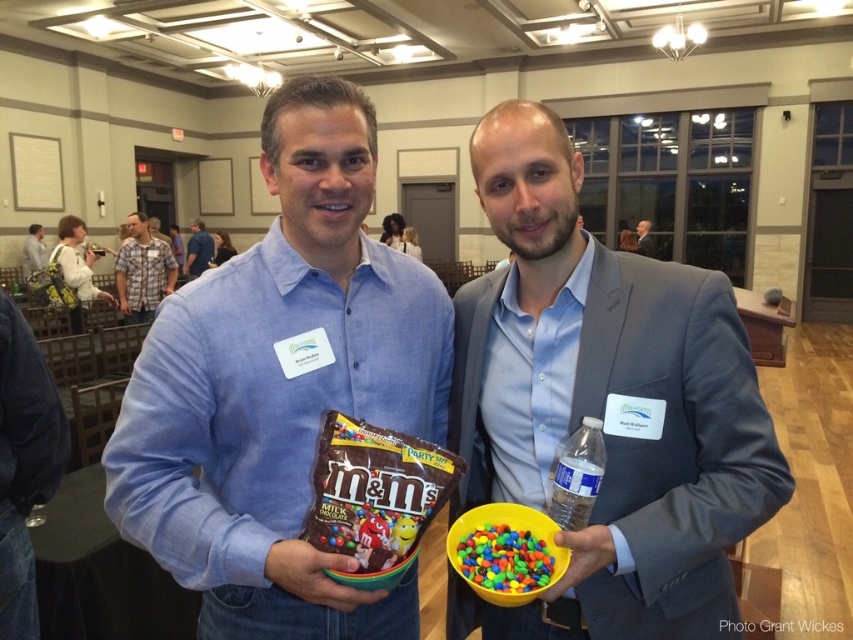
Which is more to the right, matte blue shirt at center or light brown leather jacket at upper left?

From the viewer's perspective, matte blue shirt at center appears more on the right side.

Does point (335, 621) lie behind point (56, 253)?

No, (335, 621) is closer to viewer.

Locate an element on the screen. matte blue shirt at center is located at coordinates (281, 387).

The height and width of the screenshot is (640, 853). Find the location of `matte blue shirt at center`. matte blue shirt at center is located at coordinates (281, 387).

Is matte blue shirt at center to the left of dark gray suit at upper right from the viewer's perspective?

Yes, matte blue shirt at center is to the left of dark gray suit at upper right.

Is point (274, 388) farther from camera compared to point (653, 253)?

No, (274, 388) is closer to viewer.

The image size is (853, 640). What are the coordinates of `matte blue shirt at center` in the screenshot? It's located at (281, 387).

Identify the location of matte blue shirt at center. (281, 387).

Can you confirm if light brown leather jacket at upper left is smaller than blue cotton shirt at center?

Actually, light brown leather jacket at upper left might be larger than blue cotton shirt at center.

Between point (74, 316) and point (204, 244), which one is positioned behind?

The point (204, 244) is more distant.

Is point (74, 320) less distant than point (187, 252)?

That is True.

Identify the location of light brown leather jacket at upper left. This screenshot has height=640, width=853. (77, 260).